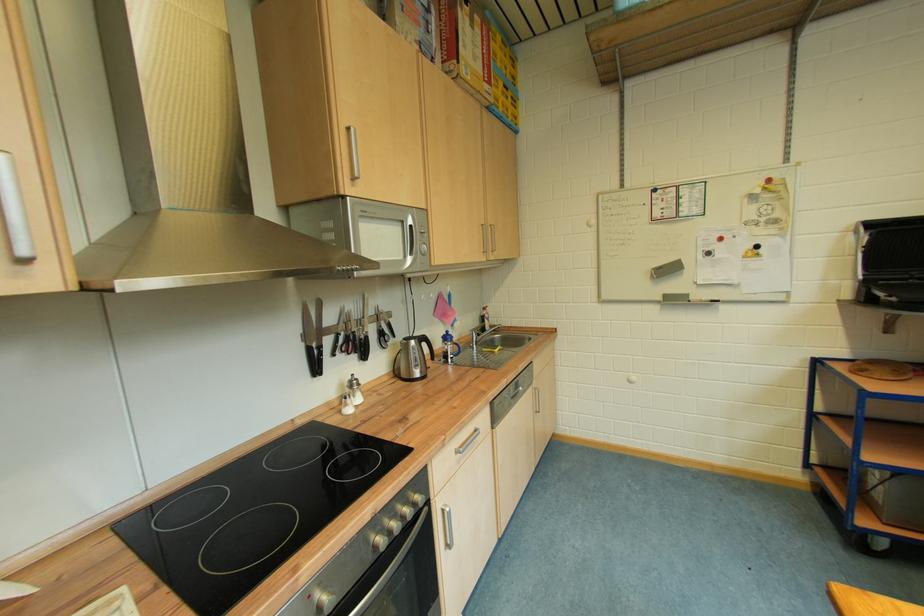
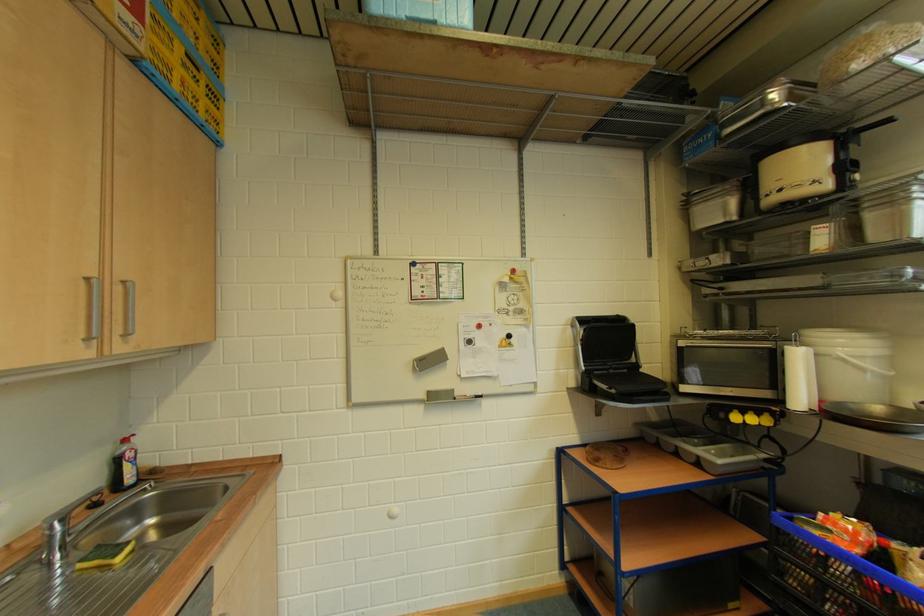
In the second image, find the point that corresponds to the point at 660,274 in the first image.

(421, 365)